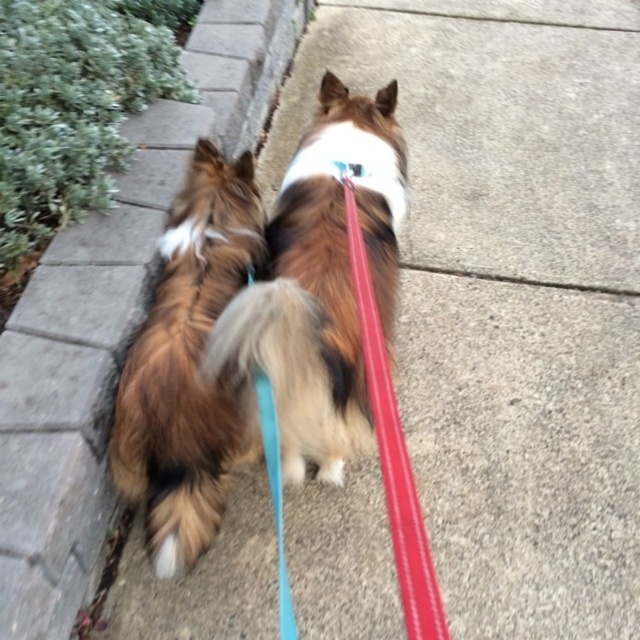
Question: Is rubberized red leash at center bigger than blue fabric collar at upper center?

Choices:
 (A) yes
 (B) no

Answer: (A)

Question: Can you confirm if brown fluffy dog at center is smaller than rubberized red leash at center?

Choices:
 (A) no
 (B) yes

Answer: (A)

Question: Which of the following is the farthest from the observer?

Choices:
 (A) (x=262, y=412)
 (B) (x=51, y=561)
 (C) (x=330, y=122)
 (D) (x=336, y=163)

Answer: (C)

Question: Considering the relative positions of brown fluffy dog at center and brown fluffy dog at left in the image provided, where is brown fluffy dog at center located with respect to brown fluffy dog at left?

Choices:
 (A) below
 (B) above

Answer: (B)

Question: Among these objects, which one is nearest to the camera?

Choices:
 (A) brown fluffy dog at center
 (B) rubberized red leash at center
 (C) blue fabric collar at upper center
 (D) concrete at upper left

Answer: (B)

Question: Estimate the real-world distances between objects in this image. Which object is farther from the rubberized red leash at center?

Choices:
 (A) brown fluffy dog at left
 (B) brown fluffy dog at center
 (C) blue fabric collar at upper center
 (D) concrete at upper left

Answer: (D)